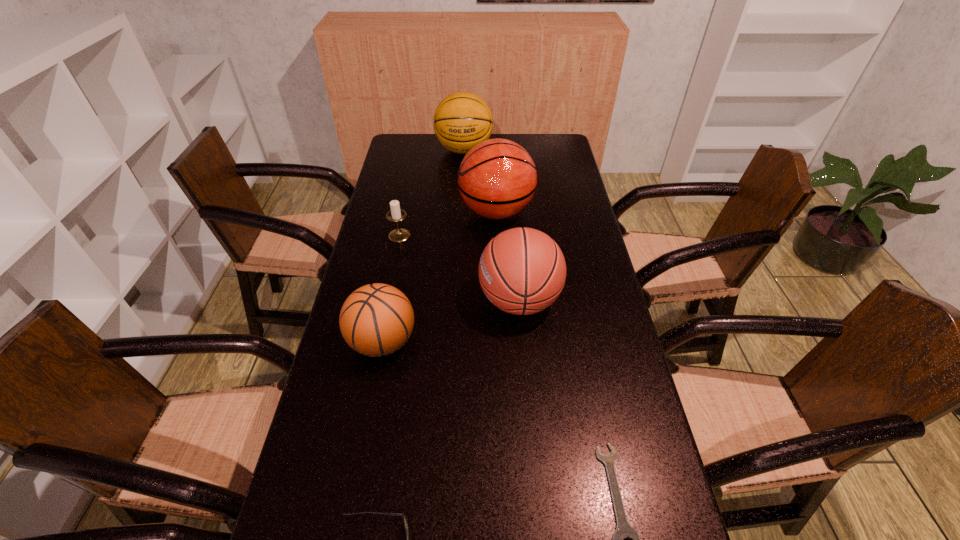
At what (x,y) coordinates should I click in order to perform the action: click on object that is positioned at the far edge. Please return your answer as a coordinate pair (x, y). Image resolution: width=960 pixels, height=540 pixels. Looking at the image, I should click on (462, 120).

Image resolution: width=960 pixels, height=540 pixels. Find the location of `basketball located in the left edge section of the desktop`. basketball located in the left edge section of the desktop is located at coordinates (377, 319).

At what (x,y) coordinates should I click in order to perform the action: click on candle holder located in the left edge section of the desktop. Please return your answer as a coordinate pair (x, y). The image size is (960, 540). Looking at the image, I should click on (396, 214).

At what (x,y) coordinates should I click in order to perform the action: click on object that is at the right edge. Please return your answer as a coordinate pair (x, y). Looking at the image, I should click on (522, 271).

Find the location of a particular element. The height and width of the screenshot is (540, 960). vacant area at the left edge is located at coordinates pos(397,288).

In the image, there is a desktop. Identify the location of vacant area at the right edge. The height and width of the screenshot is (540, 960). (567, 207).

Where is `vacant region at the far left corner of the desktop`? This screenshot has height=540, width=960. vacant region at the far left corner of the desktop is located at coordinates (413, 153).

Identify the location of free space between the farthest object and the candle holder. (432, 193).

The width and height of the screenshot is (960, 540). In order to click on vacant area that lies between the farthest basketball and the third shortest object in this screenshot , I will do `click(432, 193)`.

Find the location of a particular element. free space between the shortest basketball and the farthest object is located at coordinates (423, 246).